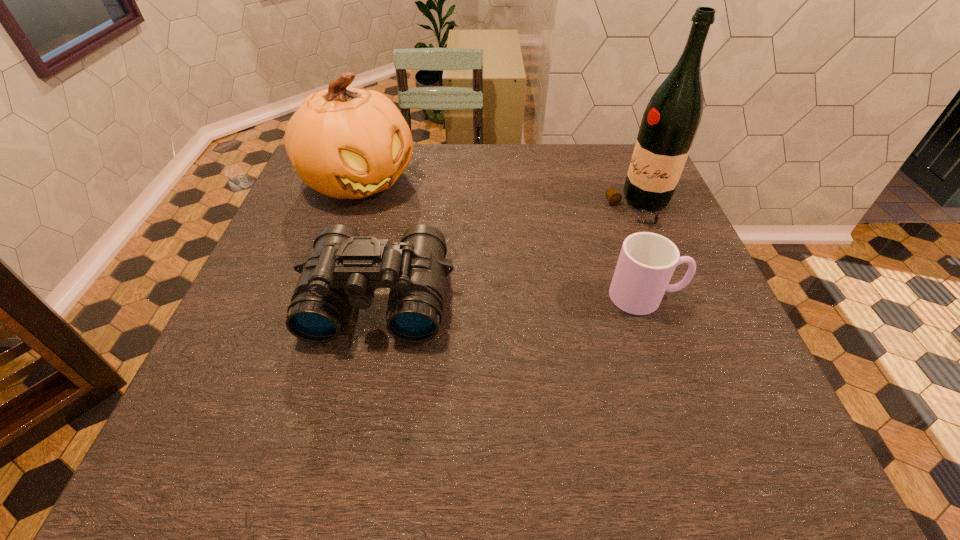
Locate an element on the screen. This screenshot has height=540, width=960. the second shortest object is located at coordinates [x=344, y=269].

Identify the location of the shortest object. This screenshot has height=540, width=960. (647, 261).

What are the coordinates of `pumpkin` in the screenshot? It's located at (348, 143).

The width and height of the screenshot is (960, 540). I want to click on wine bottle, so click(670, 122).

The height and width of the screenshot is (540, 960). I want to click on vacant area situated through the lenses of the third tallest object, so 362,372.

You are a GUI agent. You are given a task and a screenshot of the screen. Output one action in this format:
    pyautogui.click(x=<x>, y=<y>)
    Task: Click on the free space located on the front face of the second tallest object
    This screenshot has height=540, width=960.
    Given the screenshot: What is the action you would take?
    pyautogui.click(x=474, y=277)

Locate an element on the screen. The height and width of the screenshot is (540, 960). vacant space located 0.120m on the front face of the second tallest object is located at coordinates (418, 230).

Identify the location of free space located on the front face of the second tallest object. The image size is (960, 540). (480, 282).

At what (x,y) coordinates should I click in order to perform the action: click on vacant space located 0.060m on the surface of the tallest object. Please return your answer as a coordinate pair (x, y). This screenshot has height=540, width=960. Looking at the image, I should click on (604, 230).

Locate an element on the screen. free space located 0.390m on the surface of the tallest object is located at coordinates (503, 291).